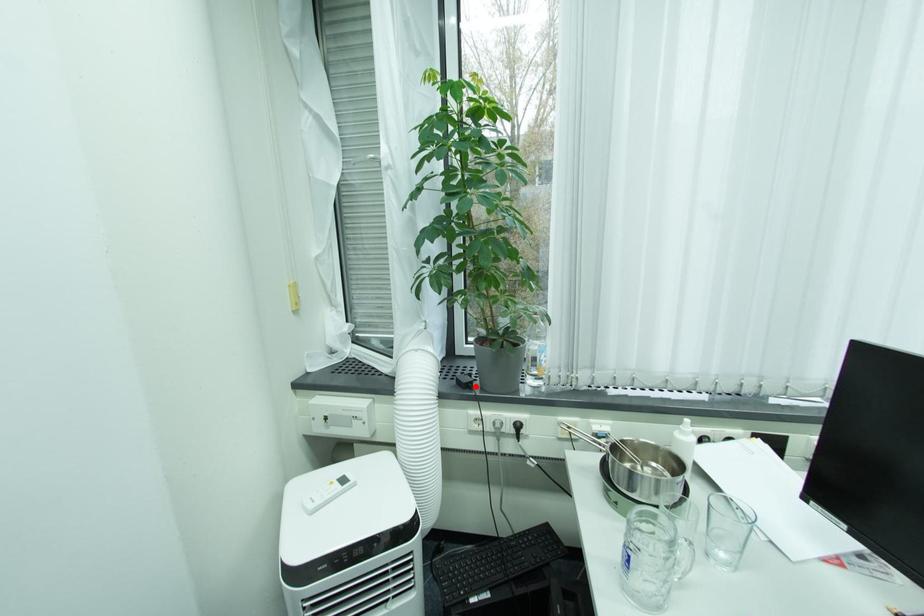
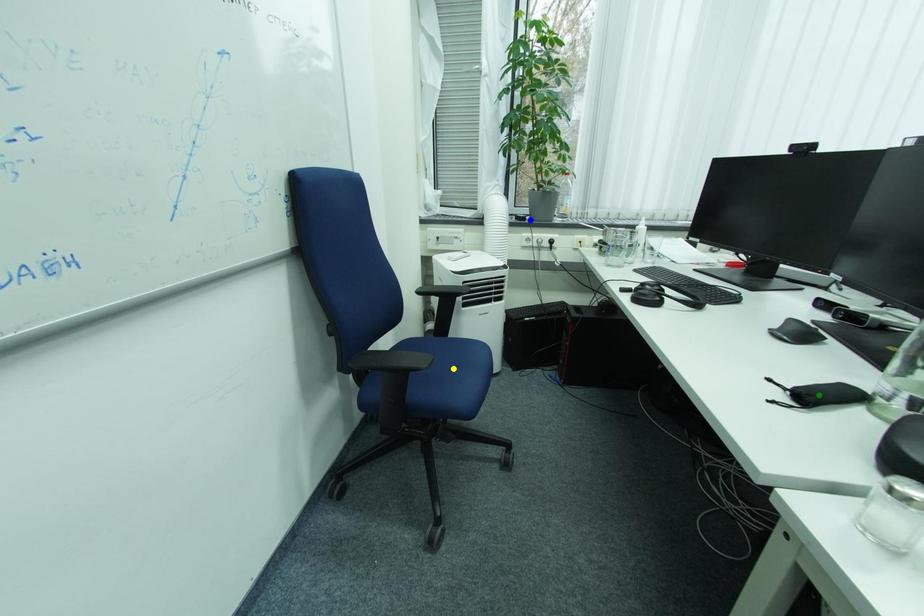
Question: I am providing you with two images of the same scene from different viewpoints. A red point is marked on the first image. You are given multiple points on the second image. Which mark in image 2 goes with the point in image 1?

Choices:
 (A) yellow point
 (B) green point
 (C) blue point

Answer: (C)